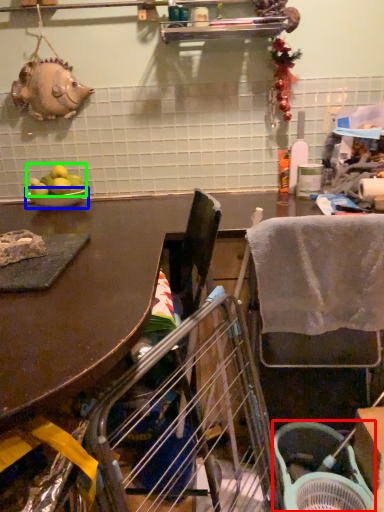
Question: Which is farther away from basket (highlighted by a red box)? bowl (highlighted by a blue box) or fruit (highlighted by a green box)?

Choices:
 (A) bowl
 (B) fruit

Answer: (B)